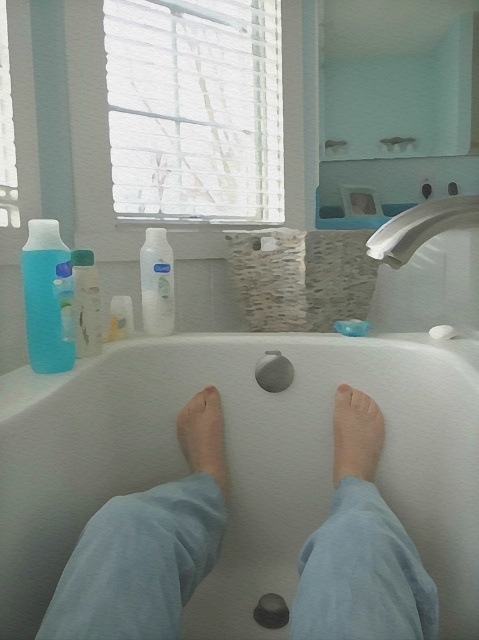
Question: Estimate the real-world distances between objects in this image. Which object is farther from the white matte soap at upper center?

Choices:
 (A) transparent plastic bottle at left
 (B) translucent plastic bottle at left
 (C) white matte bottle at center

Answer: (A)

Question: In this image, where is white matte bathtub at center located relative to white matte bottle at center?

Choices:
 (A) right
 (B) left

Answer: (A)

Question: Which point is farther to the camera?

Choices:
 (A) pale skin foot at center
 (B) translucent plastic soap at center

Answer: (B)

Question: Which is farther from the white matte soap at upper center?

Choices:
 (A) pale skin at center
 (B) translucent plastic soap at center

Answer: (A)

Question: In this image, where is pale skin foot at center located relative to pale skin at center?

Choices:
 (A) right
 (B) left

Answer: (A)

Question: Does pale skin at center come in front of translucent plastic bottle at left?

Choices:
 (A) no
 (B) yes

Answer: (A)